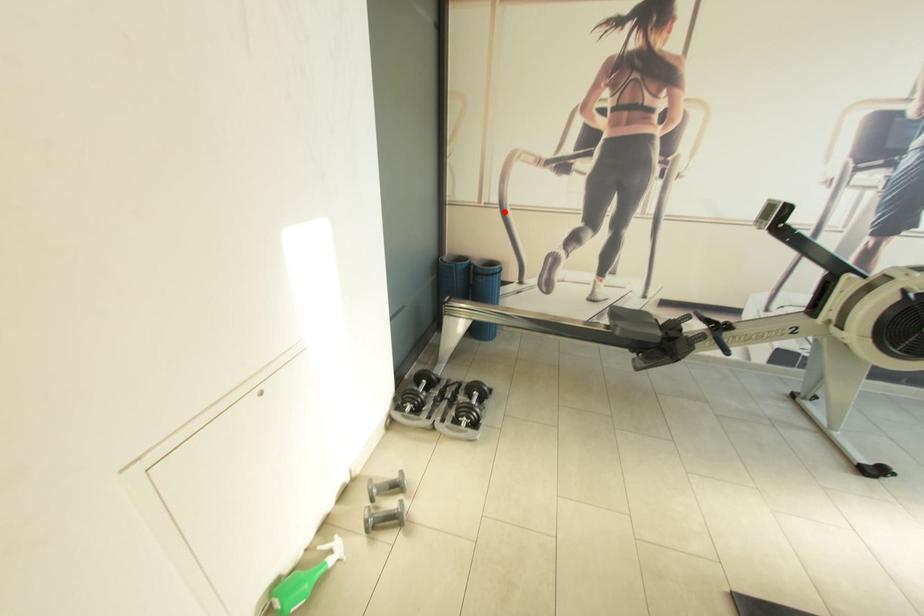
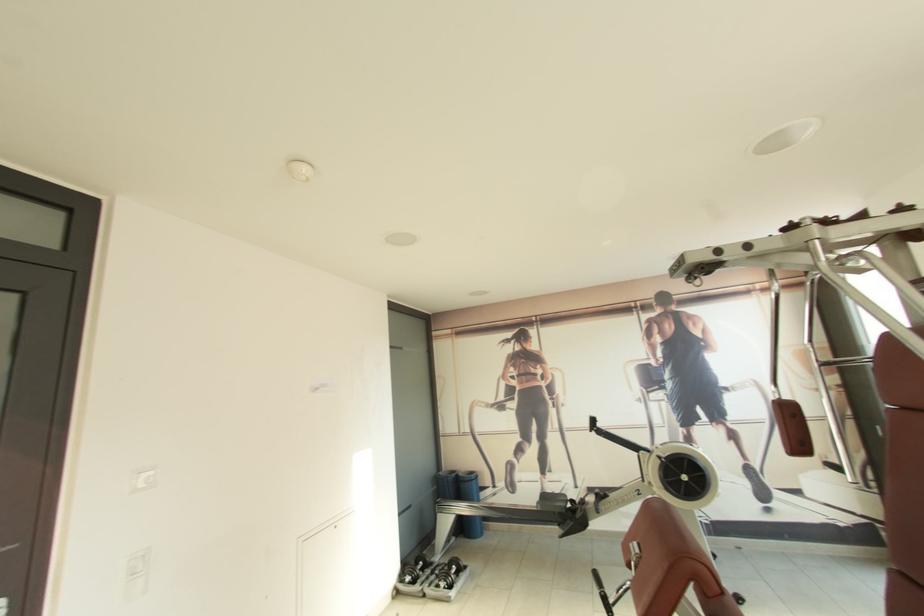
Question: I am providing you with two images of the same scene from different viewpoints. Given a red point in image1, look at the same physical point in image2. Is it:

Choices:
 (A) Closer to the viewpoint
 (B) Farther from the viewpoint

Answer: (B)